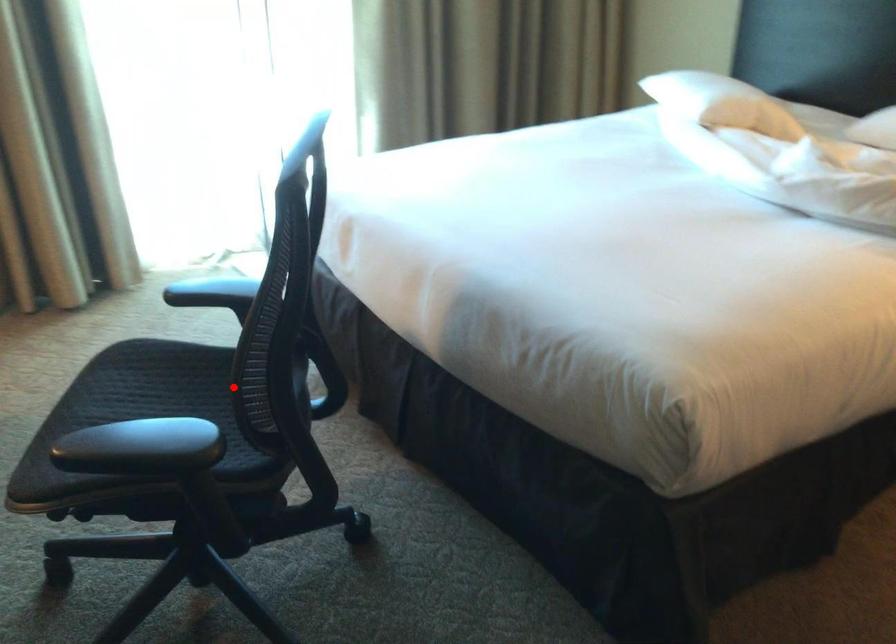
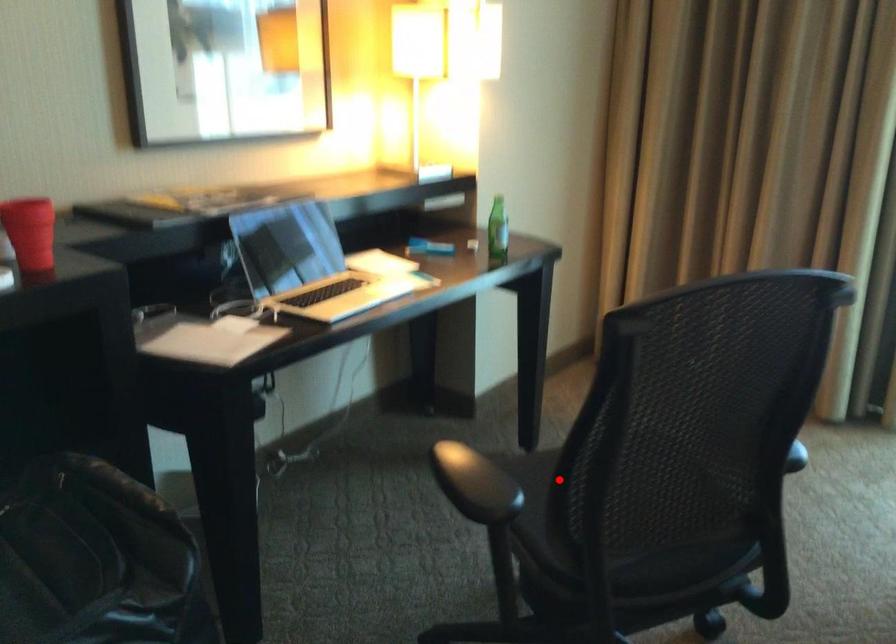
I am providing you with two images of the same scene from different viewpoints. A red point is marked on the first image and another point is marked on the second image. Is the red point in image1 aligned with the point shown in image2?

Yes